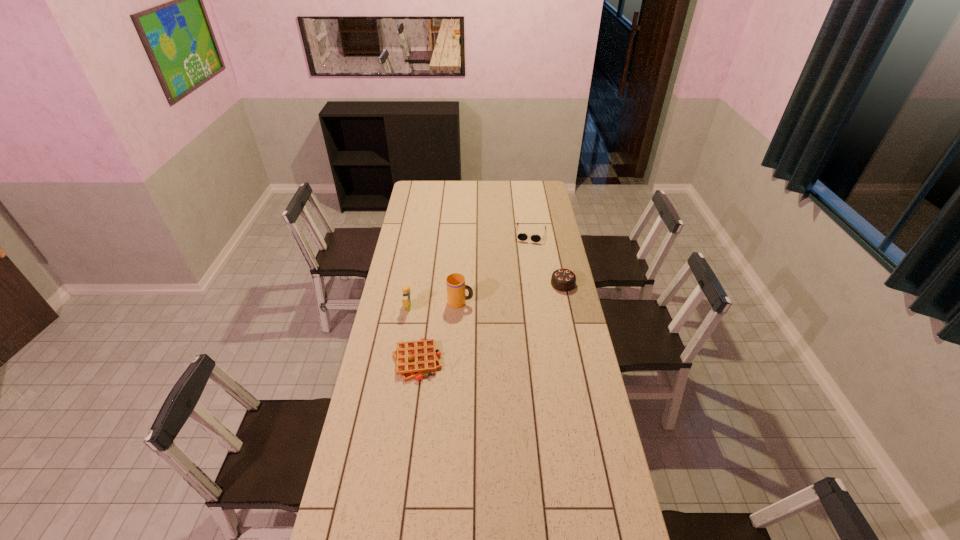
This screenshot has width=960, height=540. In order to click on vacant space on the desktop that is between the waffle and the third shortest object and is positioned on the side of the tallest object with the handle in this screenshot , I will do `click(515, 309)`.

Where is `vacant space on the desktop that is between the shortest object and the chocolate cake and is positioned on the front-facing side of the sunglasses`? The height and width of the screenshot is (540, 960). vacant space on the desktop that is between the shortest object and the chocolate cake and is positioned on the front-facing side of the sunglasses is located at coordinates (517, 307).

The height and width of the screenshot is (540, 960). Identify the location of vacant space on the desktop that is between the waffle and the third tallest object and is positioned on the face of the fourth shortest object. (517, 307).